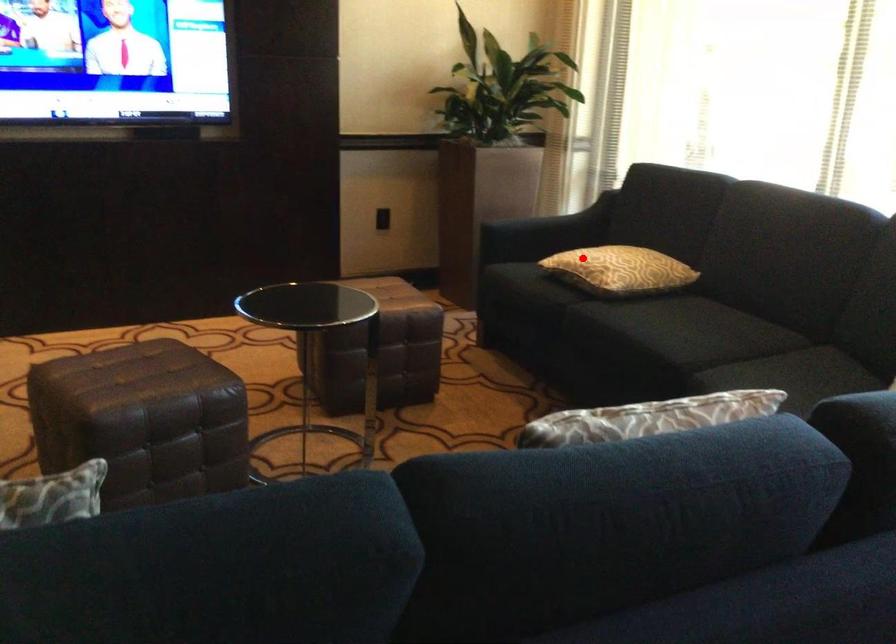
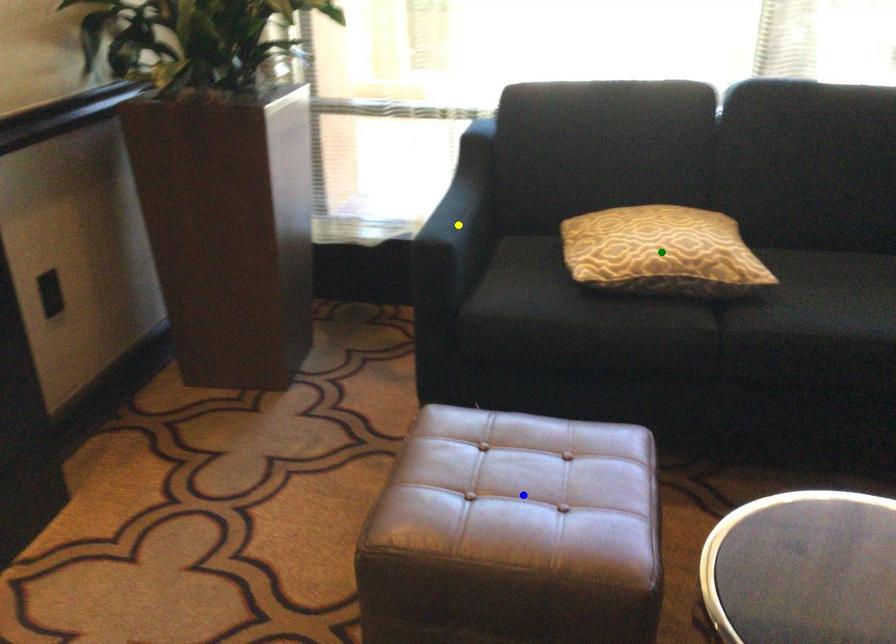
Question: I am providing you with two images of the same scene from different viewpoints. A red point is marked on the first image. You are given multiple points on the second image. Can you choose the point in image 2 that corresponds to the point in image 1?

Choices:
 (A) yellow point
 (B) green point
 (C) blue point

Answer: (B)